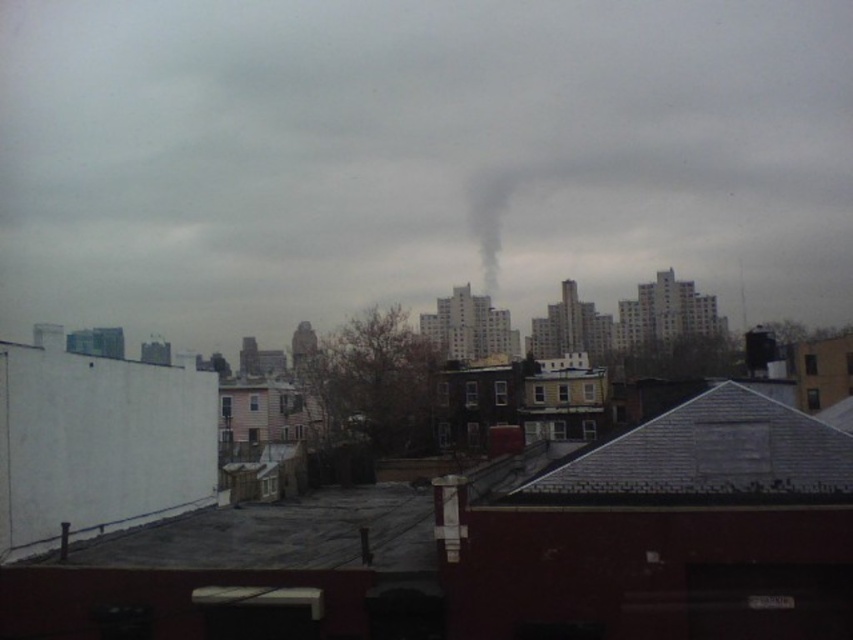
Question: Is smoke at upper center wider than black smoke at center?

Choices:
 (A) yes
 (B) no

Answer: (A)

Question: Does smoke at upper center have a lesser width compared to black smoke at center?

Choices:
 (A) no
 (B) yes

Answer: (A)

Question: Which of the following is the closest to the observer?

Choices:
 (A) (479, 234)
 (B) (108, 300)

Answer: (A)

Question: Which point is farther from the camera taking this photo?

Choices:
 (A) (378, 147)
 (B) (492, 218)

Answer: (A)

Question: Does smoke at upper center appear over black smoke at center?

Choices:
 (A) yes
 (B) no

Answer: (A)